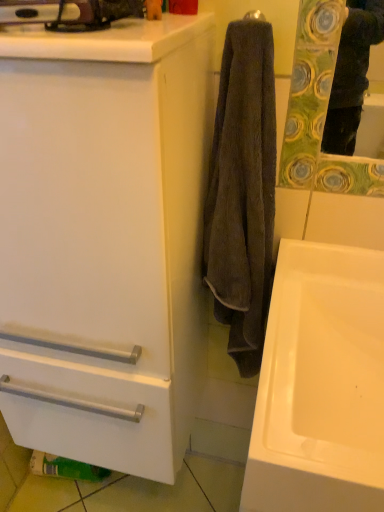
What do you see at coordinates (104, 239) in the screenshot?
I see `white matte cabinet at center` at bounding box center [104, 239].

At what (x,y) coordinates should I click in order to perform the action: click on white glossy sink at lower right. Please return your answer as a coordinate pair (x, y). The height and width of the screenshot is (512, 384). Looking at the image, I should click on (320, 384).

Can you confirm if white glossy sink at lower right is smaller than white matte cabinet at center?

Yes, white glossy sink at lower right is smaller than white matte cabinet at center.

From a real-world perspective, which object stands above the other?

From a 3D spatial view, white matte cabinet at center is above.

Does point (346, 256) come closer to viewer compared to point (165, 315)?

No, (346, 256) is behind (165, 315).

Which object is more forward, white glossy sink at lower right or white matte cabinet at center?

Answer: white matte cabinet at center is closer to the camera.

From a real-world perspective, does white matte cabinet at center sit lower than dark brown towel at center?

Correct, in the physical world, white matte cabinet at center is lower than dark brown towel at center.

At what (x,y) coordinates should I click in order to perform the action: click on towel/napkin that appears above the white matte cabinet at center (from the image's perspective). Please return your answer as a coordinate pair (x, y). This screenshot has width=384, height=512. Looking at the image, I should click on (243, 191).

Could you tell me if white matte cabinet at center is turned towards dark brown towel at center?

No, white matte cabinet at center does not turn towards dark brown towel at center.

Considering the sizes of objects white matte cabinet at center and dark brown towel at center in the image provided, who is bigger, white matte cabinet at center or dark brown towel at center?

white matte cabinet at center.

Can you confirm if dark brown towel at center is positioned to the left of white glossy sink at lower right?

Yes, dark brown towel at center is to the left of white glossy sink at lower right.

From the picture: Is the depth of dark brown towel at center greater than that of white glossy sink at lower right?

Yes, dark brown towel at center is further from the viewer.

How many degrees apart are the facing directions of dark brown towel at center and white glossy sink at lower right?

9.73e-06 degrees.

Is dark brown towel at center wider than white glossy sink at lower right?

Incorrect, the width of dark brown towel at center does not surpass that of white glossy sink at lower right.

From the picture: Considering the positions of objects white glossy sink at lower right and dark brown towel at center in the image provided, who is more to the left, white glossy sink at lower right or dark brown towel at center?

dark brown towel at center.

Considering the positions of points (314, 416) and (272, 154), is point (314, 416) farther from camera compared to point (272, 154)?

No.

How many degrees apart are the facing directions of white glossy sink at lower right and dark brown towel at center?

white glossy sink at lower right and dark brown towel at center are facing 9.73e-06 degrees away from each other.

Considering the relative sizes of white glossy sink at lower right and dark brown towel at center in the image provided, is white glossy sink at lower right wider than dark brown towel at center?

Yes, white glossy sink at lower right is wider than dark brown towel at center.

Which object is positioned more to the left, white matte cabinet at center or white glossy sink at lower right?

white matte cabinet at center.

Is white matte cabinet at center inside the boundaries of white glossy sink at lower right, or outside?

white matte cabinet at center is not inside white glossy sink at lower right, it's outside.

Between white matte cabinet at center and white glossy sink at lower right, which one has larger width?

white glossy sink at lower right is wider.

Is white matte cabinet at center positioned before white glossy sink at lower right?

Yes, white matte cabinet at center is in front of white glossy sink at lower right.

Where is `towel/napkin above the white matte cabinet at center (from a real-world perspective)`? towel/napkin above the white matte cabinet at center (from a real-world perspective) is located at coordinates (243, 191).

Consider the image. What's the angular difference between dark brown towel at center and white matte cabinet at center's facing directions?

The facing directions of dark brown towel at center and white matte cabinet at center are 1.23e-05 degrees apart.

Which object is positioned more to the right, dark brown towel at center or white matte cabinet at center?

Positioned to the right is dark brown towel at center.

Can you confirm if dark brown towel at center is shorter than white matte cabinet at center?

Yes.

The width and height of the screenshot is (384, 512). In order to click on sink lying below the white matte cabinet at center (from the image's perspective) in this screenshot , I will do `click(320, 384)`.

The image size is (384, 512). What are the coordinates of `bathroom cabinet on the left of dark brown towel at center` in the screenshot? It's located at tap(104, 239).

Estimate the real-world distances between objects in this image. Which object is further from white matte cabinet at center, white glossy sink at lower right or dark brown towel at center?

Based on the image, white glossy sink at lower right appears to be further to white matte cabinet at center.

When comparing their distances from dark brown towel at center, does white matte cabinet at center or white glossy sink at lower right seem closer?

The object closer to dark brown towel at center is white glossy sink at lower right.

Estimate the real-world distances between objects in this image. Which object is closer to dark brown towel at center, white glossy sink at lower right or white matte cabinet at center?

Among the two, white glossy sink at lower right is located nearer to dark brown towel at center.

Looking at the image, which one is located further to white matte cabinet at center, dark brown towel at center or white glossy sink at lower right?

Based on the image, white glossy sink at lower right appears to be further to white matte cabinet at center.

From the picture: From the image, which object appears to be nearer to white glossy sink at lower right, white matte cabinet at center or dark brown towel at center?

dark brown towel at center is closer to white glossy sink at lower right.

Based on their spatial positions, is dark brown towel at center or white matte cabinet at center further from white glossy sink at lower right?

white matte cabinet at center is further to white glossy sink at lower right.

Identify the location of towel/napkin between white matte cabinet at center and white glossy sink at lower right from left to right. (243, 191).